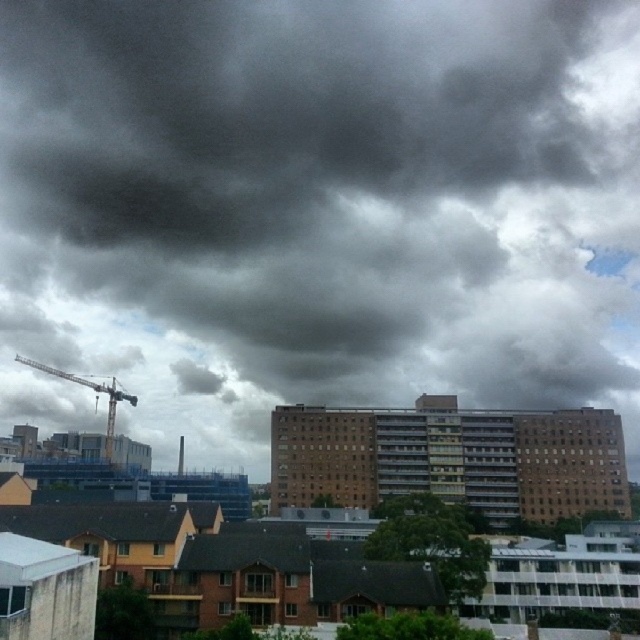
Between point (442, 372) and point (132, 394), which one is positioned behind?

Point (442, 372)

At what (x,y) coordinates should I click in order to perform the action: click on dark gray cloud at upper center. Please return your answer as a coordinate pair (x, y). The image size is (640, 640). Looking at the image, I should click on (316, 211).

Find the location of a particular element. The image size is (640, 640). dark gray cloud at upper center is located at coordinates (316, 211).